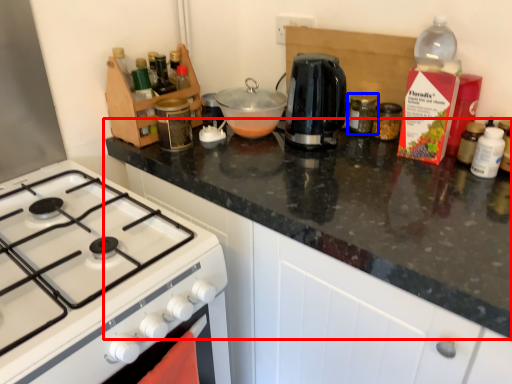
Question: Which object is closer to the camera taking this photo, countertop (highlighted by a red box) or kitchen appliance (highlighted by a blue box)?

Choices:
 (A) countertop
 (B) kitchen appliance

Answer: (A)